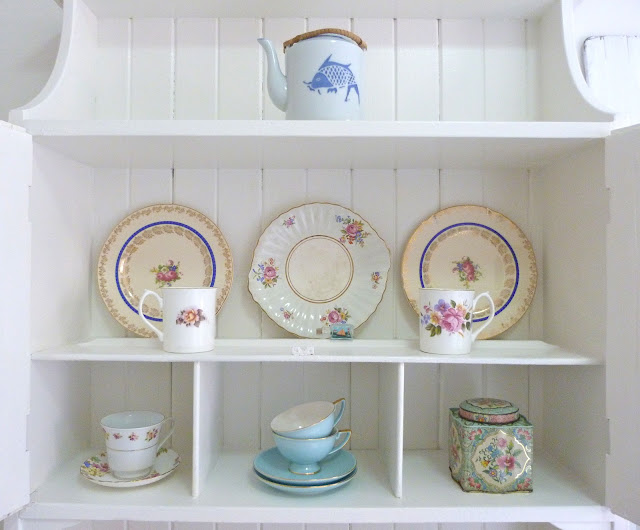
The image size is (640, 530). In order to click on blue fish art in this screenshot , I will do `click(328, 82)`.